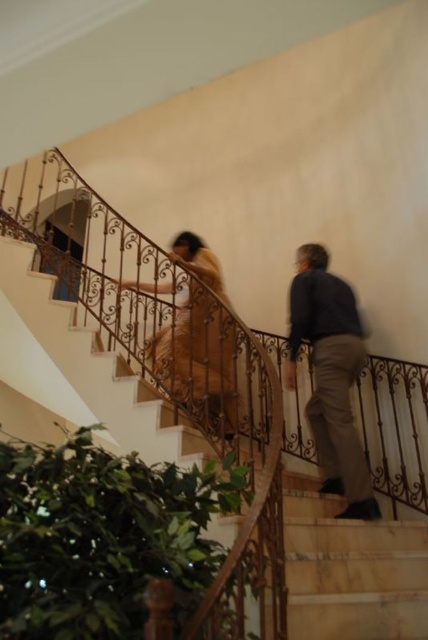
Which is more to the left, dark blue shirt at right or brown textured dress at center?

Positioned to the left is brown textured dress at center.

Is dark blue shirt at right in front of brown textured dress at center?

That is False.

Who is more forward, (312, 410) or (196, 356)?

Point (312, 410) is more forward.

Identify the location of dark blue shirt at right. Image resolution: width=428 pixels, height=640 pixels. (330, 376).

Measure the distance between point (x=207, y=456) and camera.

The distance of point (x=207, y=456) from camera is 8.36 feet.

Does marble stairs at center have a smaller size compared to tan fabric dress at center?

No, marble stairs at center is not smaller than tan fabric dress at center.

Identify the location of marble stairs at center. (79, 374).

Between marble stairs at center and dark blue shirt at right, which one has more height?

With more height is dark blue shirt at right.

Find the location of a particular element. marble stairs at center is located at coordinates pyautogui.click(x=79, y=374).